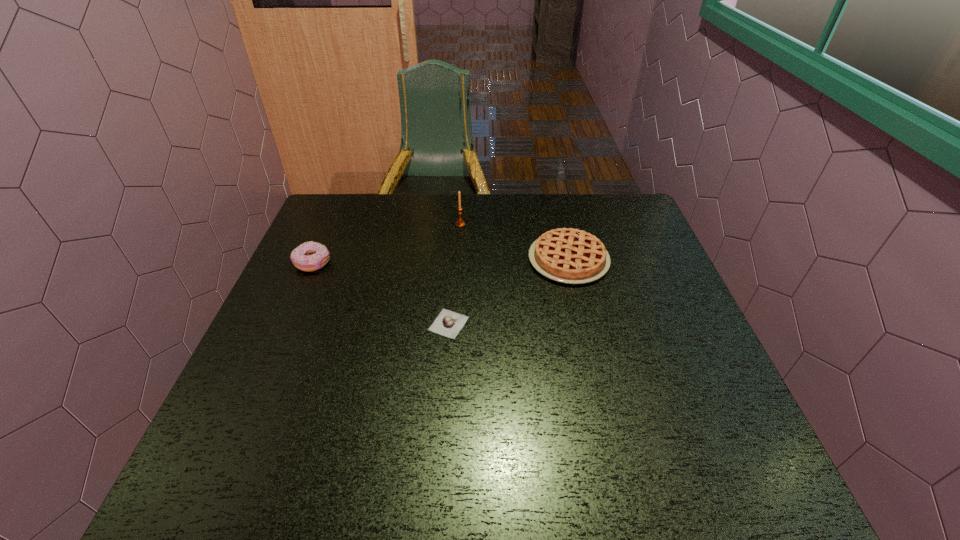
At what (x,y) coordinates should I click in order to perform the action: click on vacant space located on the right of the garlic. Please return your answer as a coordinate pair (x, y). This screenshot has width=960, height=540. Looking at the image, I should click on (494, 324).

The height and width of the screenshot is (540, 960). I want to click on candle_holder located at the far edge, so click(460, 223).

Locate an element on the screen. This screenshot has height=540, width=960. pie situated at the far edge is located at coordinates (567, 255).

At what (x,y) coordinates should I click in order to perform the action: click on object that is positioned at the left edge. Please return your answer as a coordinate pair (x, y). Looking at the image, I should click on (310, 256).

At what (x,y) coordinates should I click in order to perform the action: click on object located at the right edge. Please return your answer as a coordinate pair (x, y). This screenshot has height=540, width=960. Looking at the image, I should click on (567, 255).

What are the coordinates of `object present at the far right corner` in the screenshot? It's located at (567, 255).

This screenshot has width=960, height=540. In the image, there is a desktop. In order to click on vacant region at the far edge in this screenshot , I will do `click(516, 226)`.

Identify the location of free region at the near edge of the desktop. (564, 450).

In the image, there is a desktop. Identify the location of free space at the left edge. (259, 379).

Locate an element on the screen. The width and height of the screenshot is (960, 540). free space at the right edge of the desktop is located at coordinates (684, 351).